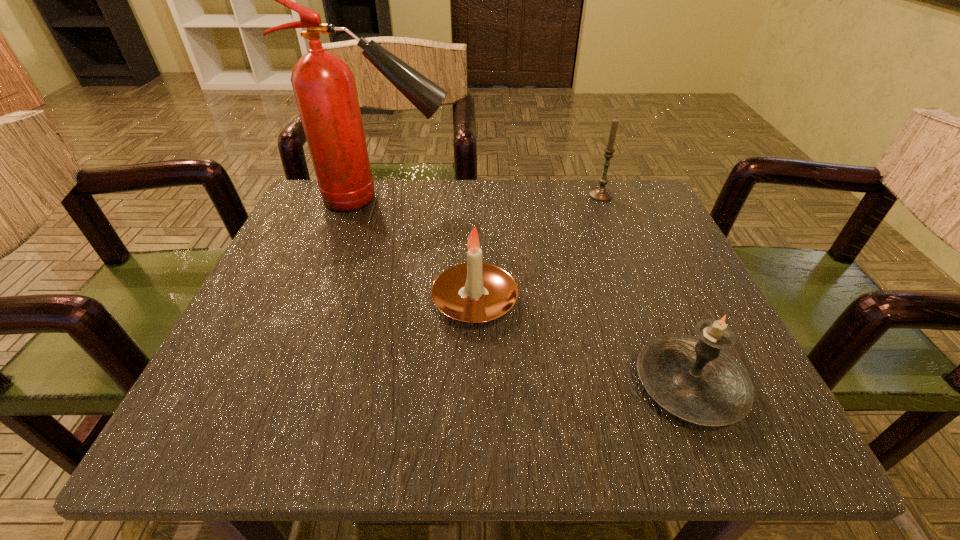
Where is `fire extinguisher`? fire extinguisher is located at coordinates (324, 86).

This screenshot has width=960, height=540. Find the location of `the farthest candle`. the farthest candle is located at coordinates (600, 193).

Identify the location of the leftmost candle. The width and height of the screenshot is (960, 540). (474, 292).

This screenshot has width=960, height=540. In order to click on the second nearest candle in this screenshot , I will do `click(474, 292)`.

Locate an element on the screen. the nearest object is located at coordinates (695, 379).

Locate an element on the screen. The width and height of the screenshot is (960, 540). blank space located 0.170m at the nozzle end of the tallest object is located at coordinates (530, 199).

Where is `vacant space located on the front of the farthest candle`? Image resolution: width=960 pixels, height=540 pixels. vacant space located on the front of the farthest candle is located at coordinates (640, 298).

Identify the location of vacant area located on the front of the third farthest object. Image resolution: width=960 pixels, height=540 pixels. (474, 396).

Where is `free location located on the back of the nearest candle`? free location located on the back of the nearest candle is located at coordinates click(616, 208).

Where is `fire extinguisher that is positioned at the far edge`? This screenshot has width=960, height=540. fire extinguisher that is positioned at the far edge is located at coordinates (x=324, y=86).